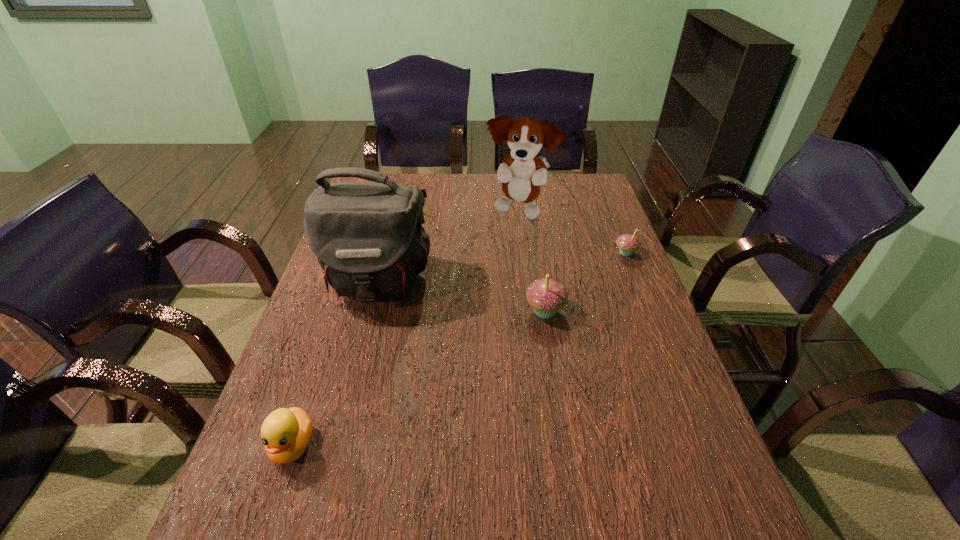
Locate an element on the screen. The image size is (960, 540). free area in between the shoulder bag and the puppy is located at coordinates (448, 247).

Where is `vacant region between the nearest object and the rightmost object`? vacant region between the nearest object and the rightmost object is located at coordinates (459, 349).

Find the location of a particular element. unoccupied area between the nearest object and the left cupcake is located at coordinates 420,378.

Where is `free space between the shoulder bag and the right cupcake`? The width and height of the screenshot is (960, 540). free space between the shoulder bag and the right cupcake is located at coordinates (501, 267).

Where is `unoccupied area between the nearer cupcake and the puppy`? This screenshot has height=540, width=960. unoccupied area between the nearer cupcake and the puppy is located at coordinates (533, 261).

Where is `vacant space in between the shorter cupcake and the puppy`? vacant space in between the shorter cupcake and the puppy is located at coordinates (572, 232).

Choose which object is the fourth nearest neighbor to the puppy. Please provide its 2D coordinates. Your answer should be formatted as a tuple, i.e. [(x, y)], where the tuple contains the x and y coordinates of a point satisfying the conditions above.

[(547, 296)]

Identify the location of the fourth closest object to the taller cupcake. The width and height of the screenshot is (960, 540). (438, 210).

I want to click on vacant space that satisfies the following two spatial constraints: 1. on the face of the nearer cupcake; 2. on the left side of the puppy, so click(532, 311).